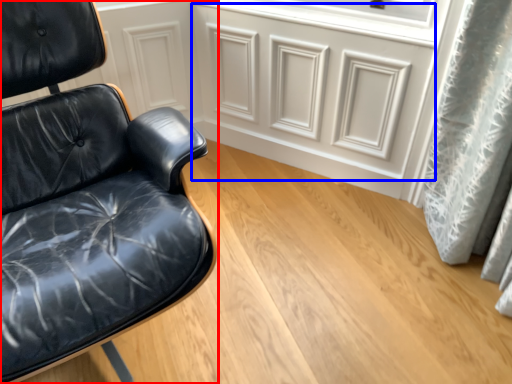
Question: Which object appears closest to the camera in this image, chair (highlighted by a red box) or drawer (highlighted by a blue box)?

Choices:
 (A) chair
 (B) drawer

Answer: (A)